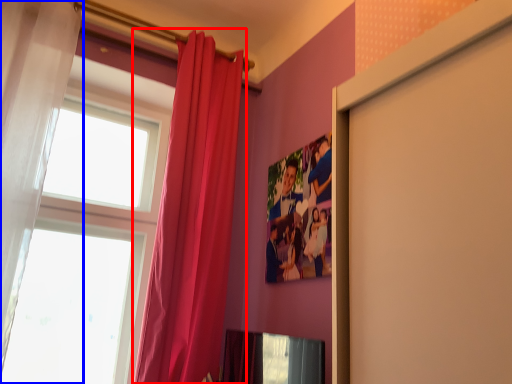
Question: Which point is closer to the camera, curtain (highlighted by a red box) or curtain (highlighted by a blue box)?

Choices:
 (A) curtain
 (B) curtain

Answer: (B)